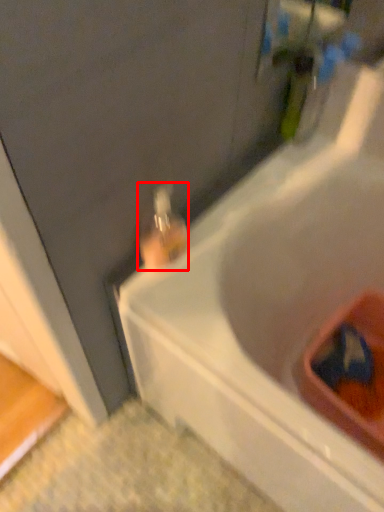
Question: From the image's perspective, what is the correct spatial positioning of bottle (annotated by the red box) in reference to bathtub?

Choices:
 (A) above
 (B) below

Answer: (A)